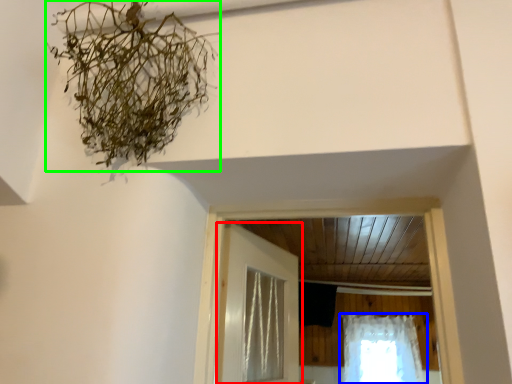
Question: Estimate the real-world distances between objects in this image. Which object is farther from door (highlighted by a red box), curtain (highlighted by a blue box) or plant (highlighted by a green box)?

Choices:
 (A) curtain
 (B) plant

Answer: (A)